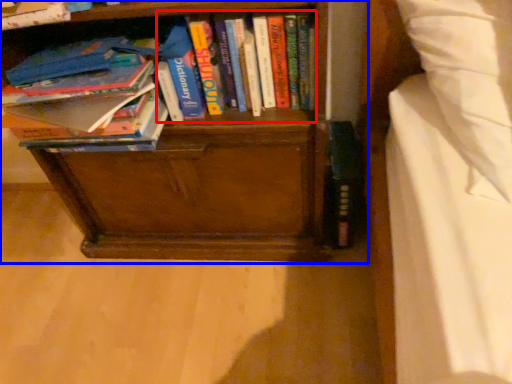
Question: Which object appears closest to the camera in this image, book (highlighted by a red box) or bookcase (highlighted by a blue box)?

Choices:
 (A) book
 (B) bookcase

Answer: (B)